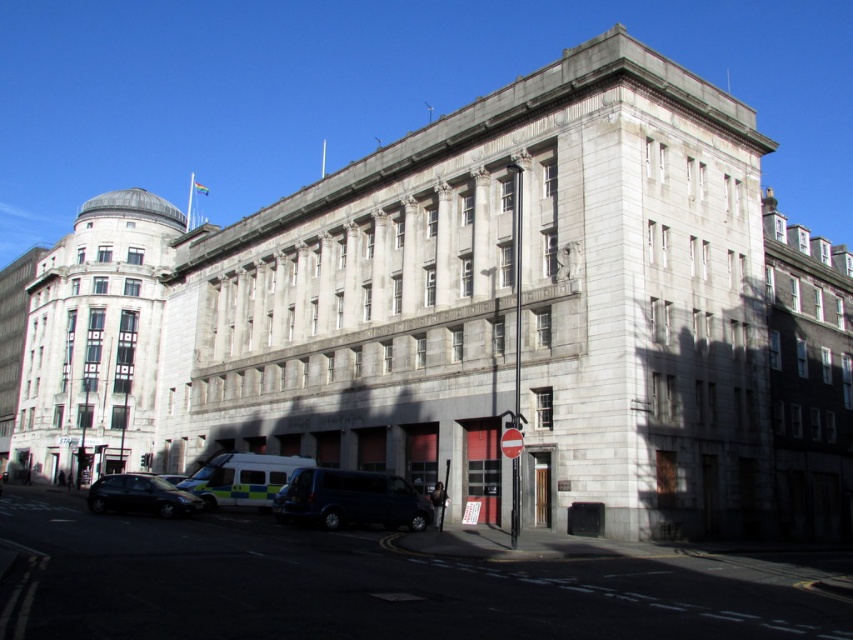
Can you confirm if white glossy ambulance at lower left is positioned to the left of shiny black car at lower left?

In fact, white glossy ambulance at lower left is to the right of shiny black car at lower left.

Looking at this image, who is positioned more to the right, white glossy ambulance at lower left or shiny black car at lower left?

From the viewer's perspective, white glossy ambulance at lower left appears more on the right side.

Who is more forward, [282,476] or [160,481]?

Point [160,481]

Identify the location of white glossy ambulance at lower left. Image resolution: width=853 pixels, height=640 pixels. (242, 477).

Which is below, dark blue van at center or shiny black car at lower left?

Positioned lower is shiny black car at lower left.

Between point (367, 481) and point (90, 502), which one is positioned in front?

Point (367, 481) is more forward.

Find the location of a particular element. The image size is (853, 640). dark blue van at center is located at coordinates (350, 499).

Between point (345, 492) and point (248, 458), which one is positioned behind?

Positioned behind is point (248, 458).

Between dark blue van at center and white glossy ambulance at lower left, which one is positioned higher?

dark blue van at center is above.

Which is behind, point (277, 509) or point (264, 477)?

The point (264, 477) is more distant.

Where is `dark blue van at center`? Image resolution: width=853 pixels, height=640 pixels. dark blue van at center is located at coordinates [350, 499].